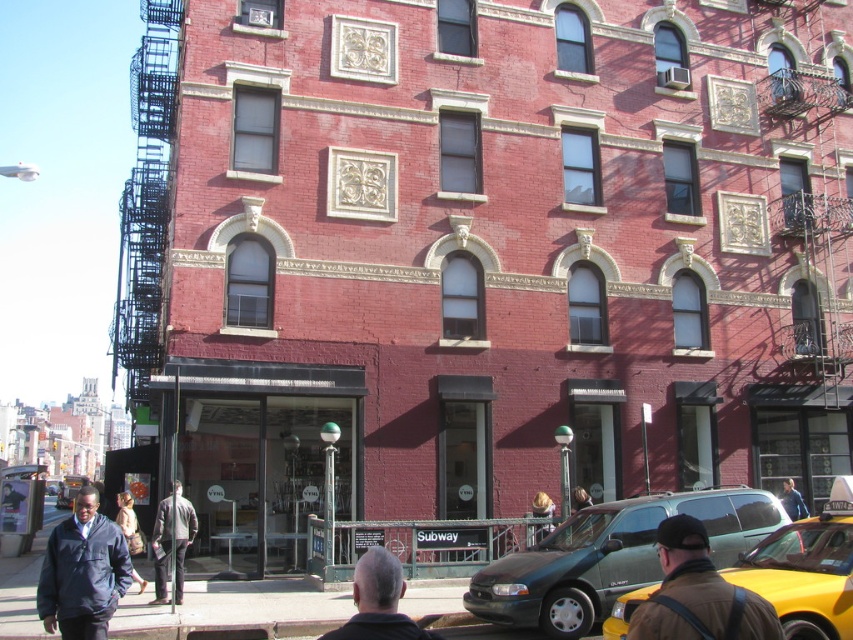
In order to click on yellow matte taxi at lower right in this screenshot , I will do `click(805, 570)`.

Can you confirm if yellow matte taxi at lower right is smaller than dark blue jacket at center?

No, yellow matte taxi at lower right is not smaller than dark blue jacket at center.

The image size is (853, 640). What do you see at coordinates (805, 570) in the screenshot?
I see `yellow matte taxi at lower right` at bounding box center [805, 570].

Identify the location of yellow matte taxi at lower right. The image size is (853, 640). click(x=805, y=570).

Based on the photo, who is more distant from viewer, (x=74, y=536) or (x=393, y=580)?

The point (x=74, y=536) is more distant.

Can you confirm if dark blue jacket at lower left is wider than dark gray hair at center?

Correct, the width of dark blue jacket at lower left exceeds that of dark gray hair at center.

Between point (80, 550) and point (376, 556), which one is positioned in front?

Point (376, 556)

You are a GUI agent. You are given a task and a screenshot of the screen. Output one action in this format:
    pyautogui.click(x=<x>, y=<y>)
    Task: Click on the dark blue jacket at lower left
    The image size is (853, 640).
    Given the screenshot: What is the action you would take?
    pyautogui.click(x=82, y=572)

Does dark blue jacket at lower left have a smaller size compared to dark blue jacket at center?

Incorrect, dark blue jacket at lower left is not smaller in size than dark blue jacket at center.

This screenshot has width=853, height=640. Describe the element at coordinates (82, 572) in the screenshot. I see `dark blue jacket at lower left` at that location.

The width and height of the screenshot is (853, 640). Identify the location of dark blue jacket at lower left. (82, 572).